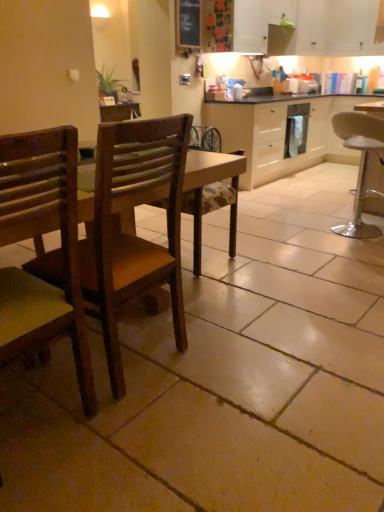
Question: Is white glossy dishwasher at center to the left of wooden chair at left, which is the third chair from right to left, from the viewer's perspective?

Choices:
 (A) no
 (B) yes

Answer: (A)

Question: Are white glossy dishwasher at center and wooden chair at left, positioned as the 1th chair in left-to-right order, making contact?

Choices:
 (A) no
 (B) yes

Answer: (A)

Question: Does white glossy dishwasher at center have a larger size compared to wooden chair at left, which is counted as the first chair, starting from the front?

Choices:
 (A) no
 (B) yes

Answer: (A)

Question: Is white glossy dishwasher at center not near wooden chair at left, positioned as the 1th chair in left-to-right order?

Choices:
 (A) no
 (B) yes

Answer: (B)

Question: From the image's perspective, would you say white glossy dishwasher at center is shown under wooden chair at left, which is the third chair from right to left?

Choices:
 (A) no
 (B) yes

Answer: (A)

Question: From a real-world perspective, is chalkboard at upper center physically located above or below wooden chair at left, placed as the second chair when sorted from front to back?

Choices:
 (A) above
 (B) below

Answer: (A)

Question: Considering their positions, is chalkboard at upper center located in front of or behind wooden chair at left, placed as the second chair when sorted from front to back?

Choices:
 (A) behind
 (B) front

Answer: (A)

Question: Considering the positions of point (180, 18) and point (120, 278), is point (180, 18) closer or farther from the camera than point (120, 278)?

Choices:
 (A) closer
 (B) farther

Answer: (B)

Question: Considering the positions of chalkboard at upper center and wooden chair at left, the second chair when ordered from left to right, in the image, is chalkboard at upper center wider or thinner than wooden chair at left, the second chair when ordered from left to right,?

Choices:
 (A) thin
 (B) wide

Answer: (A)

Question: Looking at their shapes, would you say wooden chair at left, acting as the third chair starting from the back, is wider or thinner than white matte cabinet at center, which is the 3th cabinetry from top to bottom?

Choices:
 (A) wide
 (B) thin

Answer: (B)

Question: Visually, is wooden chair at left, positioned as the 1th chair in left-to-right order, positioned to the left or to the right of white matte cabinet at center, which is the first cabinetry from bottom to top?

Choices:
 (A) right
 (B) left

Answer: (B)

Question: Looking at the image, does wooden chair at left, which is the third chair from right to left, seem bigger or smaller compared to white matte cabinet at center, which is the 3th cabinetry from top to bottom?

Choices:
 (A) big
 (B) small

Answer: (B)

Question: From their relative heights in the image, would you say wooden chair at left, acting as the third chair starting from the back, is taller or shorter than white matte cabinet at center, which is the 3th cabinetry from top to bottom?

Choices:
 (A) short
 (B) tall

Answer: (B)

Question: From their relative heights in the image, would you say white matte cabinet at upper center, marked as the 2th cabinetry in a bottom-to-top arrangement, is taller or shorter than wooden chair at left, placed as the second chair when sorted from front to back?

Choices:
 (A) tall
 (B) short

Answer: (B)

Question: Based on their sizes in the image, would you say white matte cabinet at upper center, marked as the 2th cabinetry in a bottom-to-top arrangement, is bigger or smaller than wooden chair at left, acting as the second chair starting from the back?

Choices:
 (A) big
 (B) small

Answer: (A)